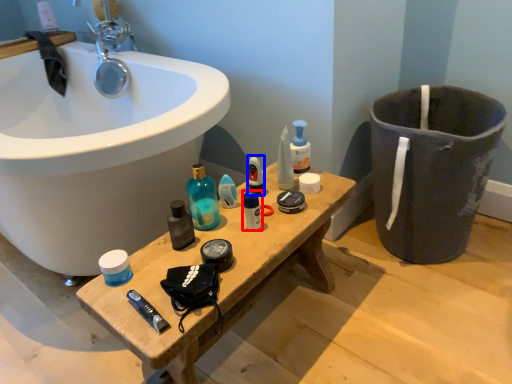
Question: Which of the following is the farthest to the observer, toiletry (highlighted by a red box) or mouthwash (highlighted by a blue box)?

Choices:
 (A) toiletry
 (B) mouthwash

Answer: (B)